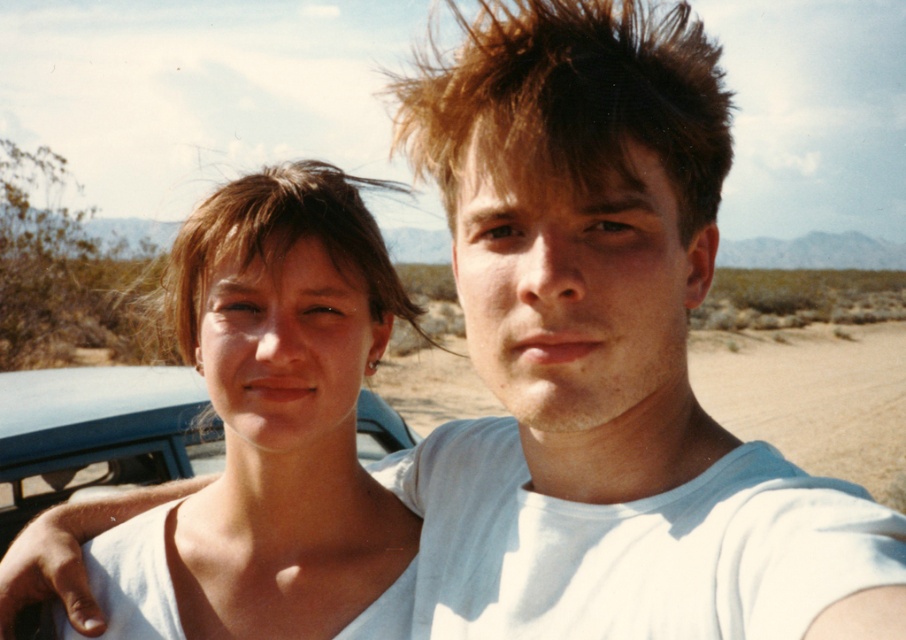
You are a photographer trying to capture a portrait of the two people in the desert. You want to ensure that the matte white tank top at center and the brown spiky hair at upper right are both clearly visible in the frame. Based on their positions, which object is closer to the camera?

The matte white tank top at center is positioned under brown spiky hair at upper right, meaning the brown spiky hair at upper right is closer to the camera.